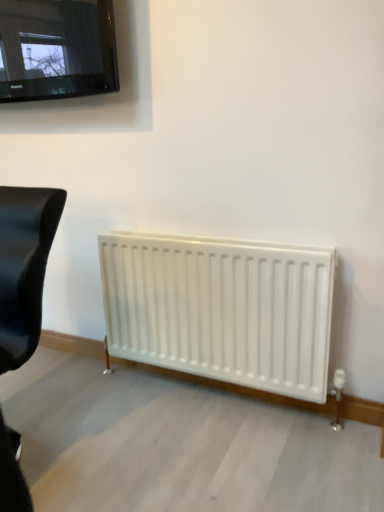
Question: Looking at the image, does black glossy television at upper left seem bigger or smaller compared to black leather chair at left?

Choices:
 (A) small
 (B) big

Answer: (A)

Question: From a real-world perspective, is black glossy television at upper left positioned above or below black leather chair at left?

Choices:
 (A) above
 (B) below

Answer: (A)

Question: Is point (39, 65) positioned closer to the camera than point (1, 321)?

Choices:
 (A) closer
 (B) farther

Answer: (B)

Question: From the image's perspective, is black leather chair at left located above or below black glossy television at upper left?

Choices:
 (A) above
 (B) below

Answer: (B)

Question: From a real-world perspective, is black leather chair at left positioned above or below black glossy television at upper left?

Choices:
 (A) above
 (B) below

Answer: (B)

Question: In terms of width, does black leather chair at left look wider or thinner when compared to black glossy television at upper left?

Choices:
 (A) wide
 (B) thin

Answer: (A)

Question: Considering the positions of point (31, 223) and point (46, 42), is point (31, 223) closer or farther from the camera than point (46, 42)?

Choices:
 (A) closer
 (B) farther

Answer: (A)